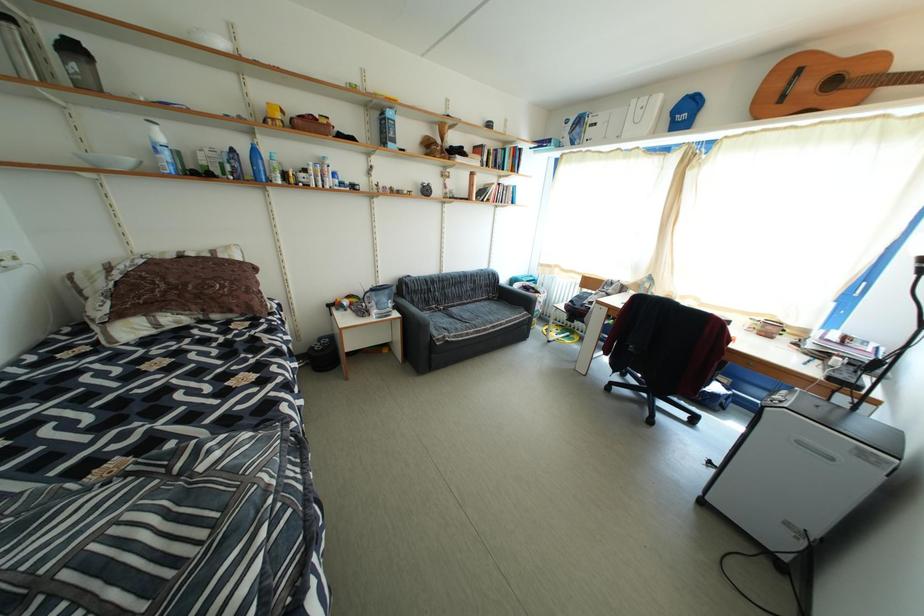
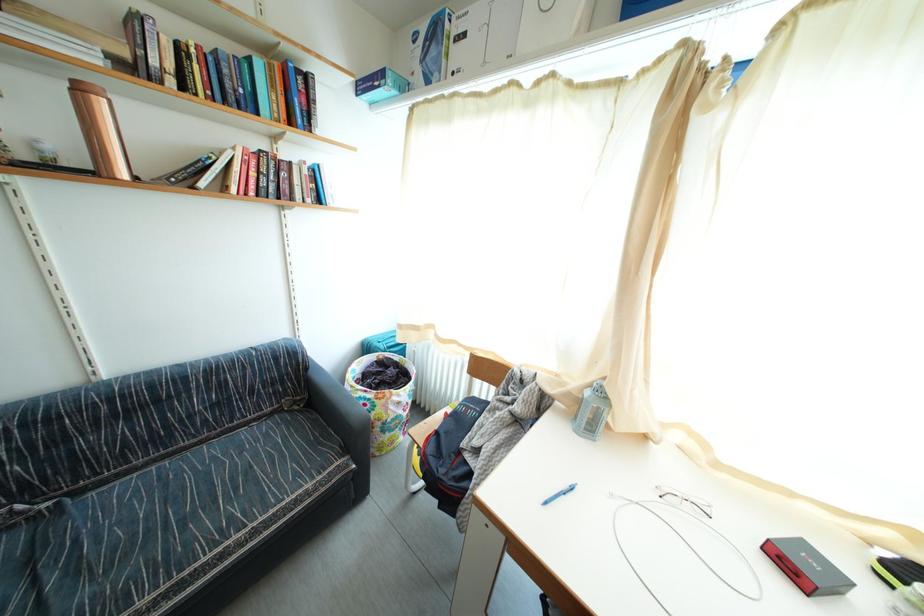
The images are taken continuously from a first-person perspective. In which direction are you moving?

The cameraman moved toward right, forward.